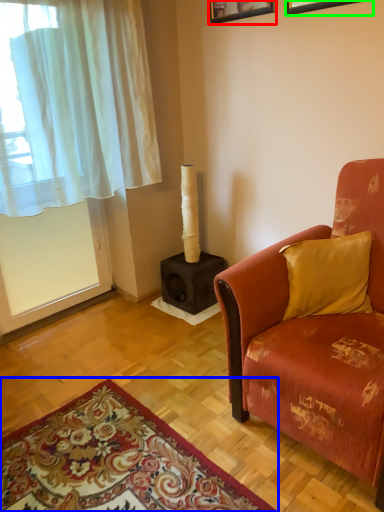
Question: Which object is the farthest from picture frame (highlighted by a red box)? Choose among these: mat (highlighted by a blue box) or picture frame (highlighted by a green box).

Choices:
 (A) mat
 (B) picture frame

Answer: (A)